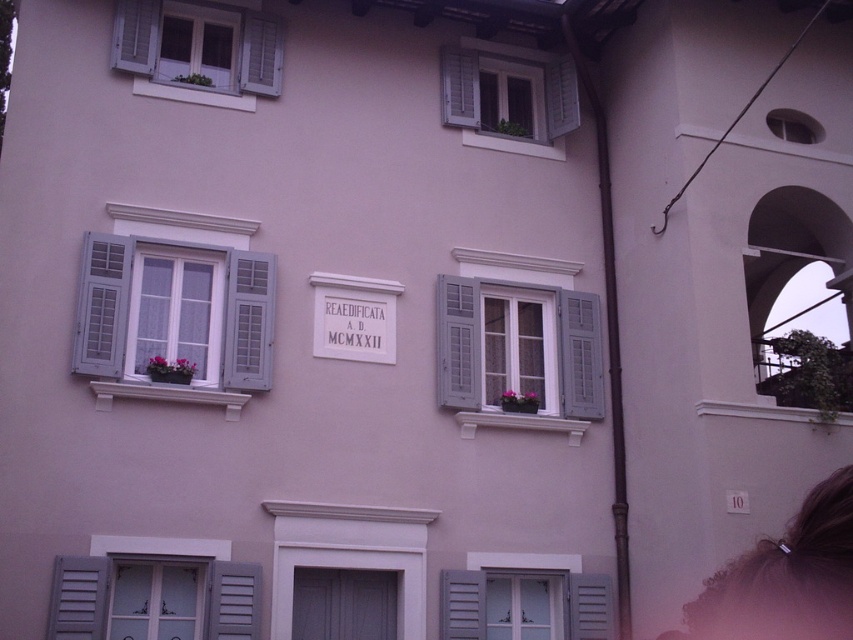
You are an architect designing a new building and want to ensure proper spacing between the matte gray shutters at lower left and the matte gray shutters at upper center. Given their height difference, which shutter should be placed lower to maintain visual balance?

The matte gray shutters at lower left is shorter than the matte gray shutters at upper center, so to maintain visual balance, the shorter matte gray shutters at lower left should be placed lower while the taller matte gray shutters at upper center should be placed higher.

You are standing in front of the building and want to touch both the matte gray shutters at center and the matte gray shutters at upper center. Which one would you need to reach out further to touch?

The matte gray shutters at upper center are further away from you than the matte gray shutters at center, so you would need to reach out further to touch the matte gray shutters at upper center.